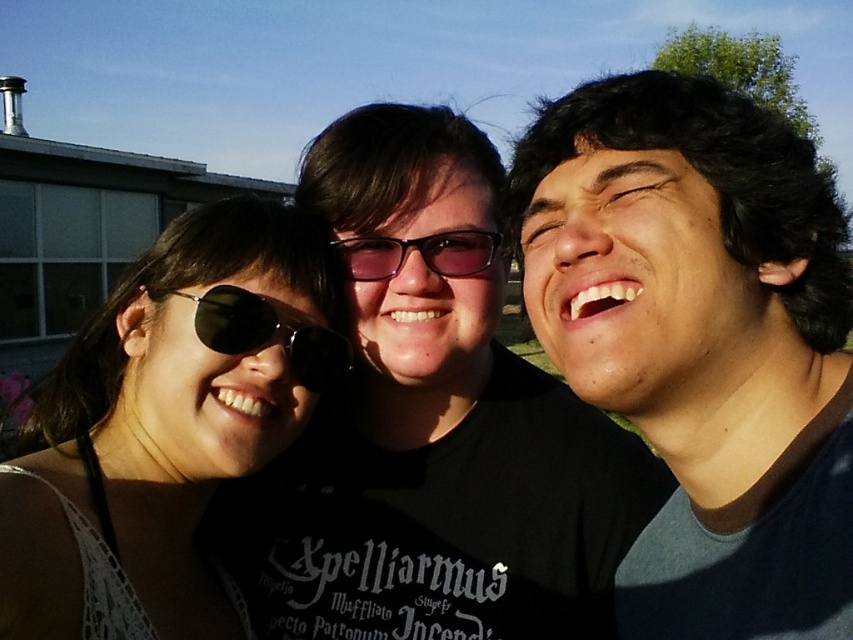
Question: Among these points, which one is farthest from the camera?

Choices:
 (A) (735, 488)
 (B) (312, 348)
 (C) (195, 634)
 (D) (341, 262)

Answer: (D)

Question: Which of the following is the closest to the observer?

Choices:
 (A) dark brown hair at upper right
 (B) black reflective sunglasses at center
 (C) purple reflective glasses at center

Answer: (A)

Question: Is sunglasses at left bigger than purple reflective glasses at center?

Choices:
 (A) yes
 (B) no

Answer: (A)

Question: Can you confirm if sunglasses at left is bigger than purple reflective glasses at center?

Choices:
 (A) yes
 (B) no

Answer: (A)

Question: Which point is farther to the camera?

Choices:
 (A) dark brown hair at upper right
 (B) black reflective sunglasses at center
 (C) purple reflective glasses at center
 (D) sunglasses at left

Answer: (C)

Question: Is black reflective sunglasses at center to the left of purple reflective glasses at center from the viewer's perspective?

Choices:
 (A) yes
 (B) no

Answer: (A)